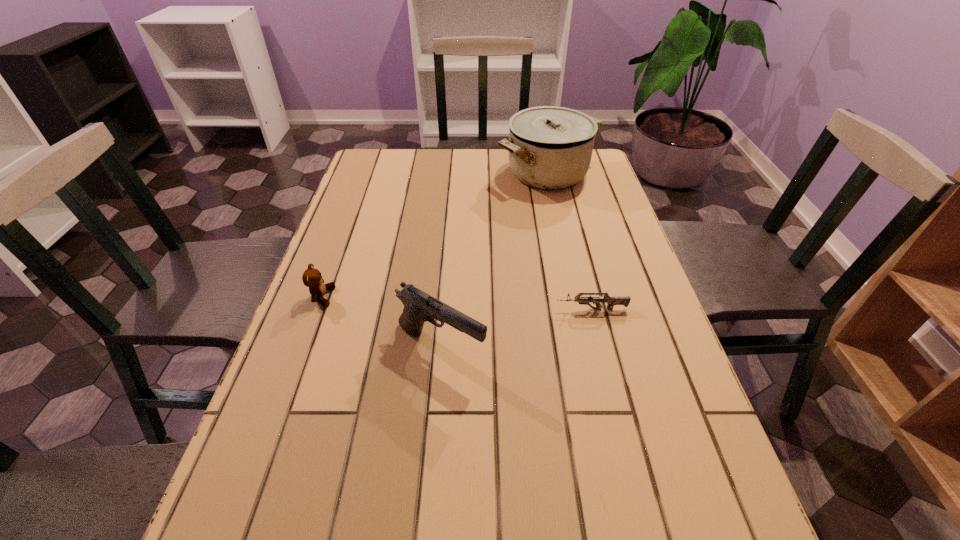
Locate an element on the screen. The image size is (960, 540). empty location between the third tallest object and the nearer gun is located at coordinates [x=381, y=322].

Locate an element on the screen. This screenshot has width=960, height=540. empty location between the farthest object and the nearest object is located at coordinates (494, 260).

Where is `blank region between the shorter gun and the tallest object`? The height and width of the screenshot is (540, 960). blank region between the shorter gun and the tallest object is located at coordinates (569, 241).

Identify which object is located as the second nearest to the taller gun. Please provide its 2D coordinates. Your answer should be formatted as a tuple, i.e. [(x, y)], where the tuple contains the x and y coordinates of a point satisfying the conditions above.

[(312, 278)]

Image resolution: width=960 pixels, height=540 pixels. I want to click on object that is the third closest to the farthest object, so click(312, 278).